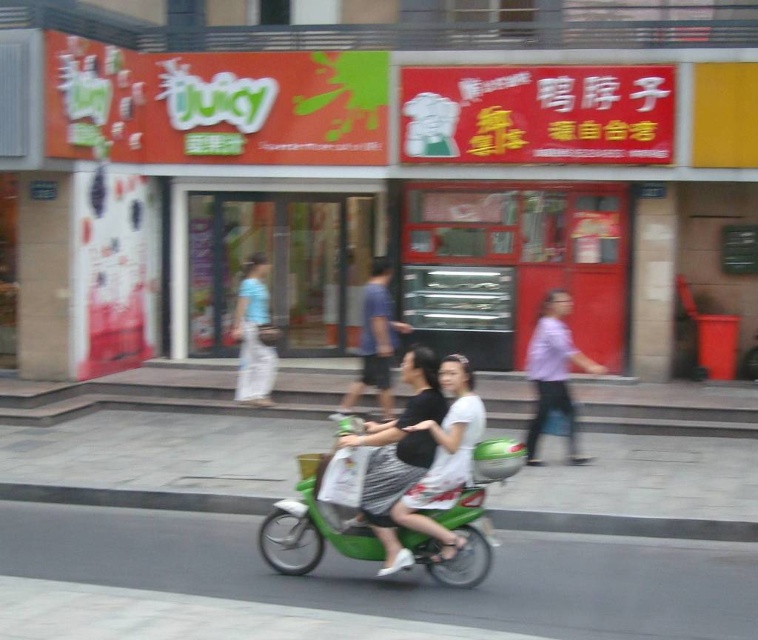
Is matte green scooter at center below purple matte shirt at center?

Actually, matte green scooter at center is above purple matte shirt at center.

Consider the image. Who is positioned more to the right, matte green scooter at center or purple matte shirt at center?

purple matte shirt at center is more to the right.

The image size is (758, 640). Describe the element at coordinates (381, 177) in the screenshot. I see `matte green scooter at center` at that location.

The image size is (758, 640). In order to click on matte green scooter at center in this screenshot , I will do `click(381, 177)`.

Who is more distant from viewer, (515,61) or (365,307)?

Point (515,61)

The height and width of the screenshot is (640, 758). What are the coordinates of `matte green scooter at center` in the screenshot? It's located at (381, 177).

Is black textured dress at center wider than purple matte shirt at center?

In fact, black textured dress at center might be narrower than purple matte shirt at center.

Which is in front, point (424, 388) or point (568, 451)?

Point (424, 388) is in front.

You are a GUI agent. You are given a task and a screenshot of the screen. Output one action in this format:
    pyautogui.click(x=<x>, y=<y>)
    Task: Click on the black textured dress at center
    This screenshot has height=640, width=758.
    Given the screenshot: What is the action you would take?
    pyautogui.click(x=399, y=452)